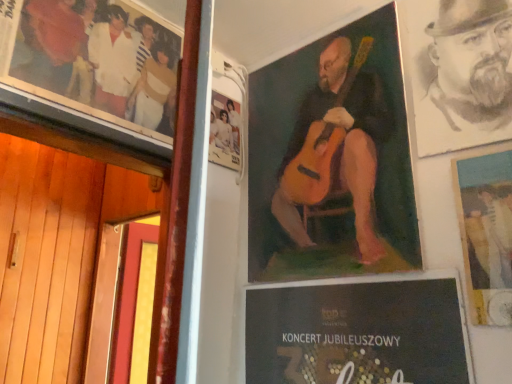
What do you see at coordinates (472, 62) in the screenshot?
I see `charcoal sketch of man at upper right` at bounding box center [472, 62].

How much space does vintage photo album at upper left, acting as the 3th poster starting from the right, occupy horizontally?

1.59 inches.

This screenshot has width=512, height=384. In order to click on vintage photo album at upper left, the 1th poster in the left-to-right sequence in this screenshot , I will do `click(98, 60)`.

In order to click on charcoal sketch of man at upper right in this screenshot , I will do `click(472, 62)`.

Consider the image. Does oil painting guitar at center, which is counted as the 2th poster, starting from the right, have a smaller size compared to charcoal sketch of man at upper right?

Incorrect, oil painting guitar at center, which is counted as the 2th poster, starting from the right, is not smaller in size than charcoal sketch of man at upper right.

Between oil painting guitar at center, which is counted as the 2th poster, starting from the right, and charcoal sketch of man at upper right, which one is positioned behind?

oil painting guitar at center, which is counted as the 2th poster, starting from the right, is further away from the camera.

In the scene shown: From a real-world perspective, is oil painting guitar at center, which is counted as the 2th poster, starting from the right, positioned above or below charcoal sketch of man at upper right?

oil painting guitar at center, which is counted as the 2th poster, starting from the right, is below charcoal sketch of man at upper right.

Who is shorter, matte paper poster at upper right, the 3th poster from the left, or oil painting guitar at center, the 2th poster in the left-to-right sequence?

matte paper poster at upper right, the 3th poster from the left.

Considering the relative positions of matte paper poster at upper right, the 3th poster from the left, and oil painting guitar at center, which is counted as the 2th poster, starting from the right, in the image provided, is matte paper poster at upper right, the 3th poster from the left, behind oil painting guitar at center, which is counted as the 2th poster, starting from the right,?

No, the depth of matte paper poster at upper right, the 3th poster from the left, is less than that of oil painting guitar at center, which is counted as the 2th poster, starting from the right.

How different are the orientations of matte paper poster at upper right, the 3th poster from the left, and oil painting guitar at center, the 2th poster in the left-to-right sequence, in degrees?

The angle between the facing direction of matte paper poster at upper right, the 3th poster from the left, and the facing direction of oil painting guitar at center, the 2th poster in the left-to-right sequence, is 0.00223 degrees.

Is matte paper poster at upper right, the 3th poster from the left, to the left of oil painting guitar at center, the 2th poster in the left-to-right sequence, from the viewer's perspective?

No.

Is oil painting guitar at center, the 2th poster in the left-to-right sequence, shorter than matte paper poster at upper right, the 3th poster from the left?

No.

Is oil painting guitar at center, which is counted as the 2th poster, starting from the right, far from matte paper poster at upper right, which is the first poster in right-to-left order?

No, oil painting guitar at center, which is counted as the 2th poster, starting from the right, is not far away from matte paper poster at upper right, which is the first poster in right-to-left order.

From the image's perspective, relative to matte paper poster at upper right, which is the first poster in right-to-left order, is oil painting guitar at center, the 2th poster in the left-to-right sequence, above or below?

oil painting guitar at center, the 2th poster in the left-to-right sequence, is situated higher than matte paper poster at upper right, which is the first poster in right-to-left order, in the image.

Is oil painting guitar at center, which is counted as the 2th poster, starting from the right, facing towards matte paper poster at upper right, the 3th poster from the left?

No.

Based on the photo, is there a large distance between matte paper poster at upper right, the 3th poster from the left, and charcoal sketch of man at upper right?

Actually, matte paper poster at upper right, the 3th poster from the left, and charcoal sketch of man at upper right are a little close together.

From the picture: Is matte paper poster at upper right, the 3th poster from the left, oriented towards charcoal sketch of man at upper right?

No, matte paper poster at upper right, the 3th poster from the left, is not oriented towards charcoal sketch of man at upper right.

From a real-world perspective, relative to charcoal sketch of man at upper right, is matte paper poster at upper right, which is the first poster in right-to-left order, vertically above or below?

In terms of real-world spatial position, matte paper poster at upper right, which is the first poster in right-to-left order, is below charcoal sketch of man at upper right.

Considering the relative sizes of matte paper poster at upper right, which is the first poster in right-to-left order, and charcoal sketch of man at upper right in the image provided, is matte paper poster at upper right, which is the first poster in right-to-left order, thinner than charcoal sketch of man at upper right?

Yes, matte paper poster at upper right, which is the first poster in right-to-left order, is thinner than charcoal sketch of man at upper right.

From a real-world perspective, is oil painting guitar at center, the 2th poster in the left-to-right sequence, positioned under vintage photo album at upper left, acting as the 3th poster starting from the right, based on gravity?

Yes, from a real-world perspective, oil painting guitar at center, the 2th poster in the left-to-right sequence, is beneath vintage photo album at upper left, acting as the 3th poster starting from the right.

How different are the orientations of oil painting guitar at center, which is counted as the 2th poster, starting from the right, and vintage photo album at upper left, the 1th poster in the left-to-right sequence, in degrees?

The facing directions of oil painting guitar at center, which is counted as the 2th poster, starting from the right, and vintage photo album at upper left, the 1th poster in the left-to-right sequence, are 89.9 degrees apart.

Can you confirm if oil painting guitar at center, the 2th poster in the left-to-right sequence, is positioned to the right of vintage photo album at upper left, the 1th poster in the left-to-right sequence?

Indeed, oil painting guitar at center, the 2th poster in the left-to-right sequence, is positioned on the right side of vintage photo album at upper left, the 1th poster in the left-to-right sequence.

Is oil painting guitar at center, the 2th poster in the left-to-right sequence, bigger than vintage photo album at upper left, acting as the 3th poster starting from the right?

No, oil painting guitar at center, the 2th poster in the left-to-right sequence, is not bigger than vintage photo album at upper left, acting as the 3th poster starting from the right.

At what (x,y) coordinates should I click in order to perform the action: click on poster that is the 2nd object directly below the charcoal sketch of man at upper right (from a real-world perspective). Please return your answer as a coordinate pair (x, y). Looking at the image, I should click on (486, 233).

Based on the photo, does charcoal sketch of man at upper right come in front of matte paper poster at upper right, the 3th poster from the left?

No, the depth of charcoal sketch of man at upper right is greater than that of matte paper poster at upper right, the 3th poster from the left.

From a real-world perspective, is charcoal sketch of man at upper right physically located above or below matte paper poster at upper right, the 3th poster from the left?

charcoal sketch of man at upper right is above matte paper poster at upper right, the 3th poster from the left.

Considering the sizes of charcoal sketch of man at upper right and matte paper poster at upper right, the 3th poster from the left, in the image, is charcoal sketch of man at upper right taller or shorter than matte paper poster at upper right, the 3th poster from the left,?

Clearly, charcoal sketch of man at upper right is taller compared to matte paper poster at upper right, the 3th poster from the left.

Would you say vintage photo album at upper left, the 1th poster in the left-to-right sequence, is inside or outside oil painting guitar at center, which is counted as the 2th poster, starting from the right?

The correct answer is: outside.

Considering the sizes of objects vintage photo album at upper left, acting as the 3th poster starting from the right, and oil painting guitar at center, which is counted as the 2th poster, starting from the right, in the image provided, who is smaller, vintage photo album at upper left, acting as the 3th poster starting from the right, or oil painting guitar at center, which is counted as the 2th poster, starting from the right,?

oil painting guitar at center, which is counted as the 2th poster, starting from the right.

Between point (148, 105) and point (288, 241), which one is positioned behind?

The point (288, 241) is more distant.

In order to click on person above the oil painting guitar at center, the 2th poster in the left-to-right sequence (from a real-world perspective) in this screenshot , I will do `click(472, 62)`.

Where is `poster below the oil painting guitar at center, the 2th poster in the left-to-right sequence (from the image's perspective)`? poster below the oil painting guitar at center, the 2th poster in the left-to-right sequence (from the image's perspective) is located at coordinates (486, 233).

From the image, which object appears to be nearer to matte paper poster at upper right, the 3th poster from the left, charcoal sketch of man at upper right or vintage photo album at upper left, the 1th poster in the left-to-right sequence?

charcoal sketch of man at upper right lies closer to matte paper poster at upper right, the 3th poster from the left, than the other object.

In the scene shown: Estimate the real-world distances between objects in this image. Which object is further from oil painting guitar at center, which is counted as the 2th poster, starting from the right, vintage photo album at upper left, the 1th poster in the left-to-right sequence, or charcoal sketch of man at upper right?

The object further to oil painting guitar at center, which is counted as the 2th poster, starting from the right, is vintage photo album at upper left, the 1th poster in the left-to-right sequence.

Considering their positions, is matte paper poster at upper right, which is the first poster in right-to-left order, positioned further to charcoal sketch of man at upper right than oil painting guitar at center, the 2th poster in the left-to-right sequence?

Among the two, oil painting guitar at center, the 2th poster in the left-to-right sequence, is located further to charcoal sketch of man at upper right.

When comparing their distances from vintage photo album at upper left, the 1th poster in the left-to-right sequence, does charcoal sketch of man at upper right or oil painting guitar at center, the 2th poster in the left-to-right sequence, seem further?

Among the two, charcoal sketch of man at upper right is located further to vintage photo album at upper left, the 1th poster in the left-to-right sequence.

Which object lies nearer to the anchor point matte paper poster at upper right, which is the first poster in right-to-left order, charcoal sketch of man at upper right or oil painting guitar at center, which is counted as the 2th poster, starting from the right?

Based on the image, charcoal sketch of man at upper right appears to be nearer to matte paper poster at upper right, which is the first poster in right-to-left order.

Which object lies nearer to the anchor point vintage photo album at upper left, the 1th poster in the left-to-right sequence, matte paper poster at upper right, the 3th poster from the left, or charcoal sketch of man at upper right?

charcoal sketch of man at upper right lies closer to vintage photo album at upper left, the 1th poster in the left-to-right sequence, than the other object.

When comparing their distances from charcoal sketch of man at upper right, does vintage photo album at upper left, acting as the 3th poster starting from the right, or oil painting guitar at center, which is counted as the 2th poster, starting from the right, seem closer?

The object closer to charcoal sketch of man at upper right is oil painting guitar at center, which is counted as the 2th poster, starting from the right.

Looking at the image, which one is located closer to oil painting guitar at center, the 2th poster in the left-to-right sequence, charcoal sketch of man at upper right or vintage photo album at upper left, the 1th poster in the left-to-right sequence?

charcoal sketch of man at upper right.

You are a GUI agent. You are given a task and a screenshot of the screen. Output one action in this format:
    pyautogui.click(x=<x>, y=<y>)
    Task: Click on the poster between vintage photo album at upper left, acting as the 3th poster starting from the right, and matte paper poster at upper right, which is the first poster in right-to-left order, from left to right
    
    Given the screenshot: What is the action you would take?
    pyautogui.click(x=332, y=159)

Find the location of `person situated between vintage photo album at upper left, the 1th poster in the left-to-right sequence, and matte paper poster at upper right, the 3th poster from the left, from left to right`. person situated between vintage photo album at upper left, the 1th poster in the left-to-right sequence, and matte paper poster at upper right, the 3th poster from the left, from left to right is located at coordinates (472, 62).

Where is `poster between vintage photo album at upper left, acting as the 3th poster starting from the right, and charcoal sketch of man at upper right`? poster between vintage photo album at upper left, acting as the 3th poster starting from the right, and charcoal sketch of man at upper right is located at coordinates (332, 159).

Where is `person between oil painting guitar at center, which is counted as the 2th poster, starting from the right, and matte paper poster at upper right, the 3th poster from the left, in the horizontal direction`? Image resolution: width=512 pixels, height=384 pixels. person between oil painting guitar at center, which is counted as the 2th poster, starting from the right, and matte paper poster at upper right, the 3th poster from the left, in the horizontal direction is located at coordinates (472, 62).